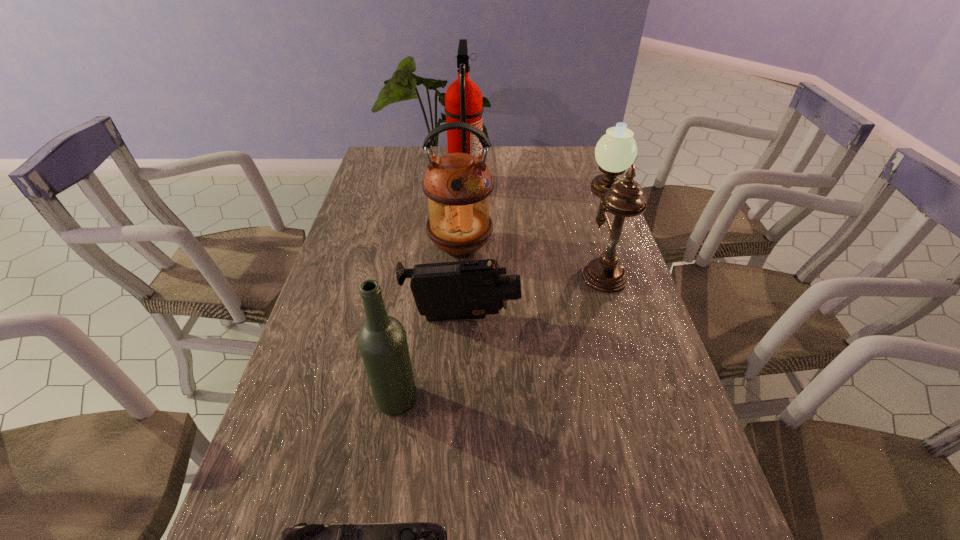
Find the location of a particular element. unoccupied position between the rightmost object and the left oil lamp is located at coordinates (530, 255).

Find the location of a particular element. This screenshot has height=540, width=960. vacant space that is in between the rightmost object and the second nearest object is located at coordinates click(498, 332).

At what (x,y) coordinates should I click in order to perform the action: click on object that stands as the closest to the left oil lamp. Please return your answer as a coordinate pair (x, y). This screenshot has width=960, height=540. Looking at the image, I should click on (472, 289).

Identify which object is the fourth nearest to the wine bottle. Please provide its 2D coordinates. Your answer should be formatted as a tuple, i.e. [(x, y)], where the tuple contains the x and y coordinates of a point satisfying the conditions above.

[(616, 151)]

At what (x,y) coordinates should I click in order to perform the action: click on blank space that satisfies the following two spatial constraints: 1. on the back side of the right oil lamp; 2. on the side of the fire extinguisher near the handle. Please return your answer as a coordinate pair (x, y). Looking at the image, I should click on (576, 183).